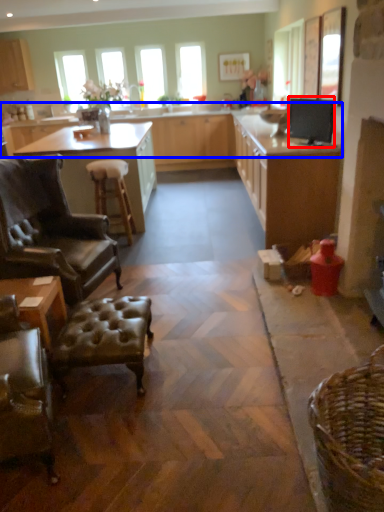
Question: Which of the following is the closest to the observer, appliance (highlighted by a red box) or countertop (highlighted by a blue box)?

Choices:
 (A) appliance
 (B) countertop

Answer: (A)